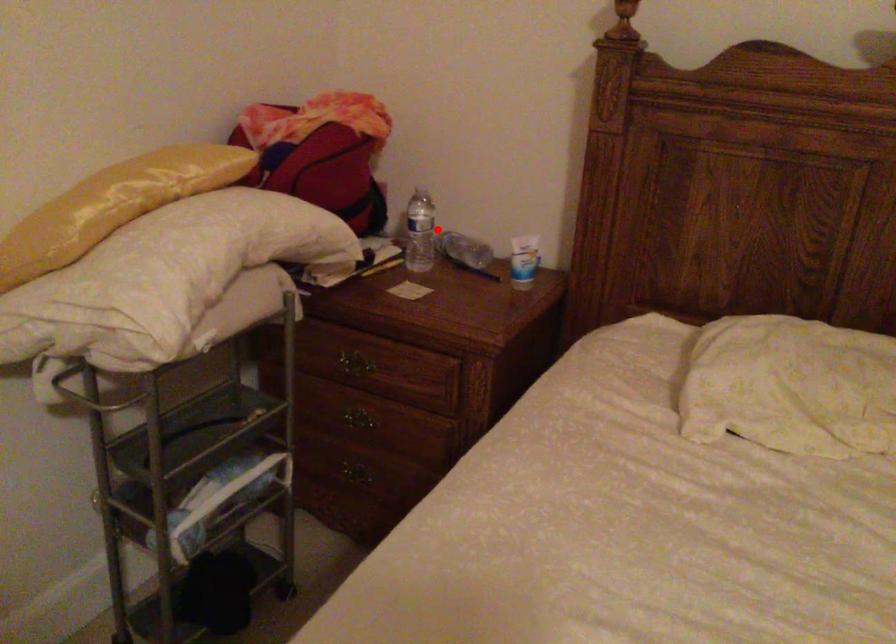
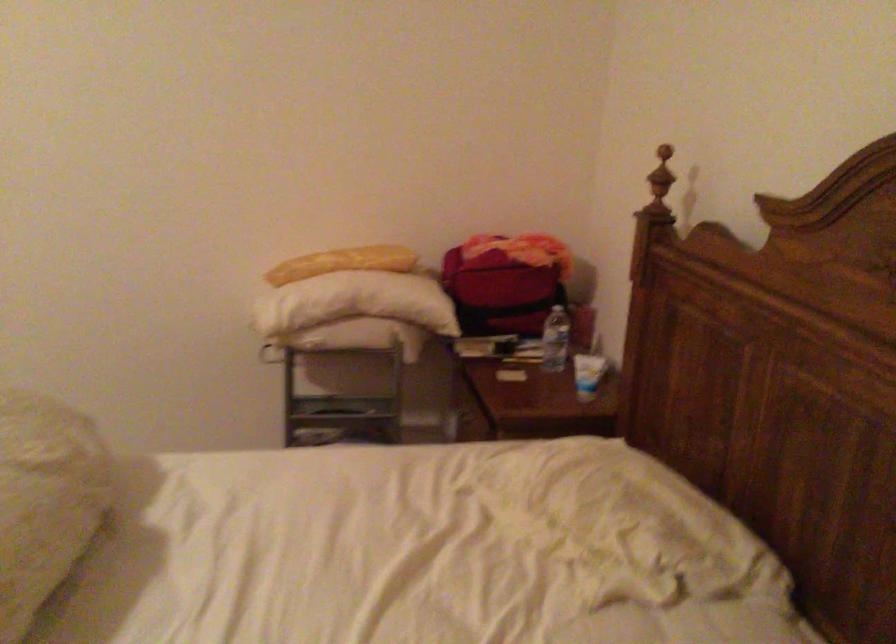
Where in the second image is the point corresponding to the highlighted location from the first image?

(556, 339)